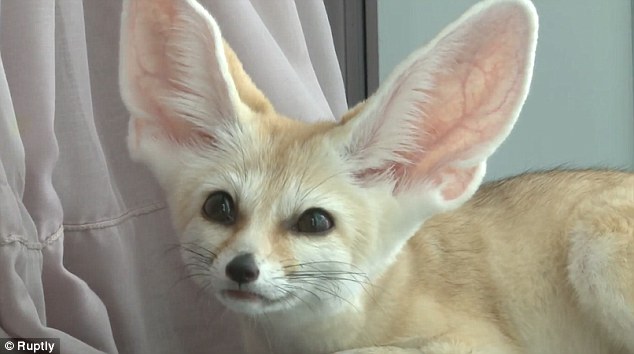
The height and width of the screenshot is (354, 634). I want to click on window frame, so click(353, 41).